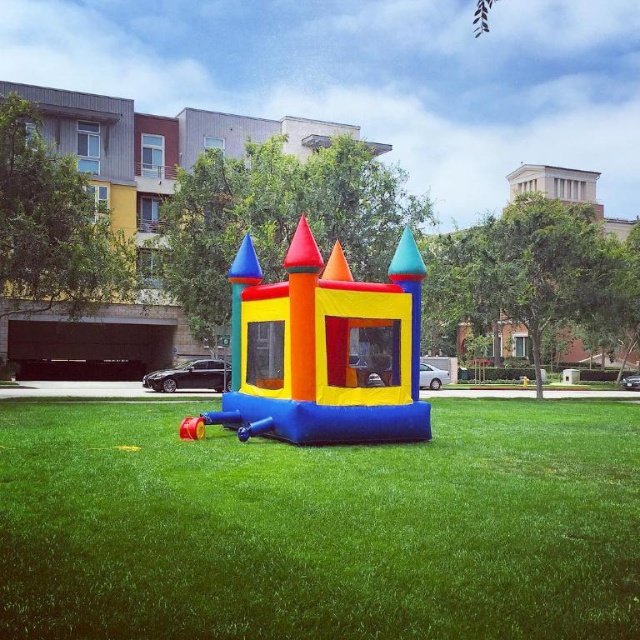
Image resolution: width=640 pixels, height=640 pixels. In order to click on blue rubber bouncy castle at center in this screenshot , I will do `click(320, 525)`.

Identify the location of blue rubber bouncy castle at center. (320, 525).

The height and width of the screenshot is (640, 640). What are the coordinates of `blue rubber bouncy castle at center` in the screenshot? It's located at (320, 525).